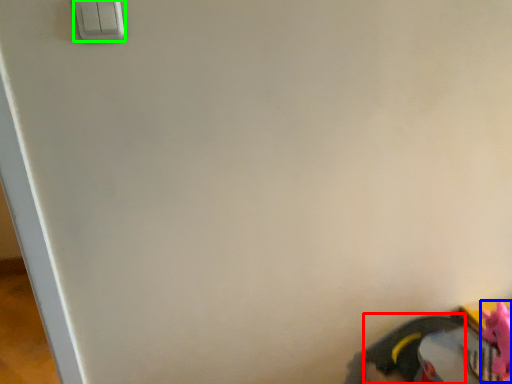
Question: Which object is positioned closest to footwear (highlighted by a red box)? Select from toy (highlighted by a blue box) and light switch (highlighted by a green box).

Choices:
 (A) toy
 (B) light switch

Answer: (A)